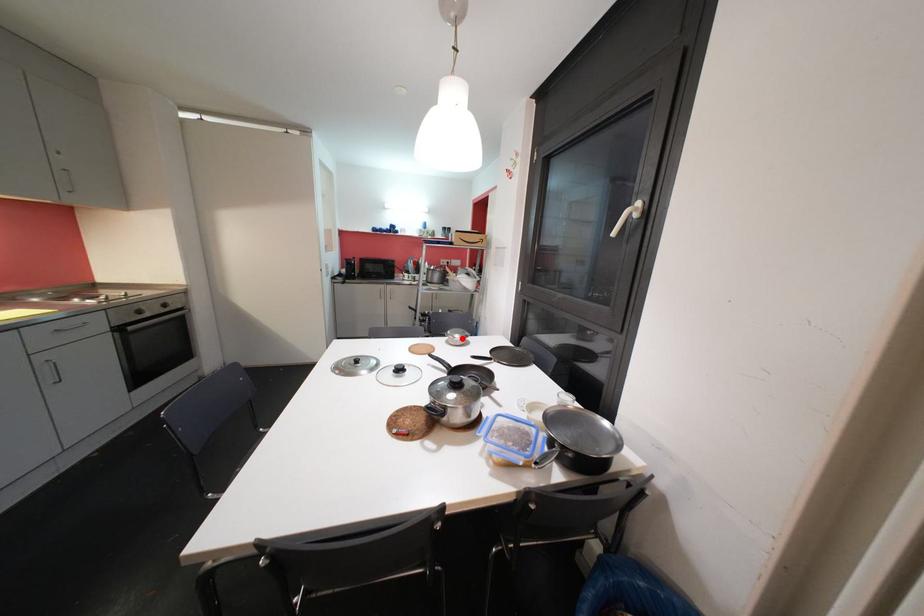
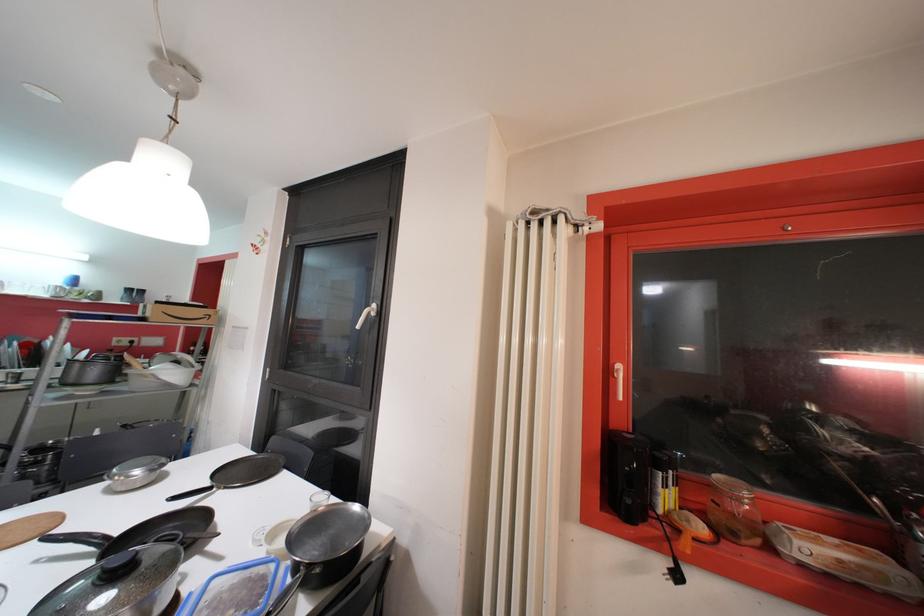
Where in the second image is the point corresponding to the highlighted location from the first image?

(142, 474)